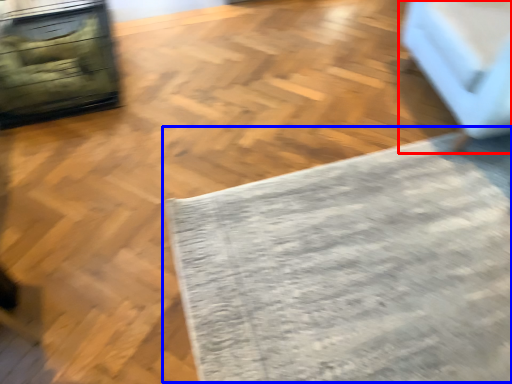
Question: Which of the following is the closest to the observer, furniture (highlighted by a red box) or mat (highlighted by a blue box)?

Choices:
 (A) furniture
 (B) mat

Answer: (B)